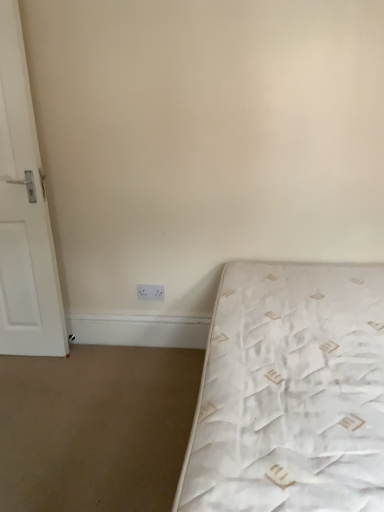
Question: Is white quilted mattress at lower right positioned with its back to white plastic electric outlet at lower center?

Choices:
 (A) yes
 (B) no

Answer: (B)

Question: Does white quilted mattress at lower right turn towards white plastic electric outlet at lower center?

Choices:
 (A) no
 (B) yes

Answer: (A)

Question: Does white quilted mattress at lower right have a lesser width compared to white plastic electric outlet at lower center?

Choices:
 (A) no
 (B) yes

Answer: (A)

Question: Is white plastic electric outlet at lower center located within white quilted mattress at lower right?

Choices:
 (A) no
 (B) yes

Answer: (A)

Question: Is white quilted mattress at lower right positioned beyond the bounds of white plastic electric outlet at lower center?

Choices:
 (A) no
 (B) yes

Answer: (B)

Question: Is point 162,286 closer or farther from the camera than point 43,288?

Choices:
 (A) farther
 (B) closer

Answer: (A)

Question: From the image's perspective, is white plastic electric outlet at lower center above or below white matte door at left?

Choices:
 (A) below
 (B) above

Answer: (A)

Question: Is white plastic electric outlet at lower center wider or thinner than white matte door at left?

Choices:
 (A) wide
 (B) thin

Answer: (B)

Question: Would you say white plastic electric outlet at lower center is inside or outside white matte door at left?

Choices:
 (A) inside
 (B) outside

Answer: (B)

Question: In the image, is white plastic electric outlet at lower center positioned in front of or behind white quilted mattress at lower right?

Choices:
 (A) behind
 (B) front

Answer: (A)

Question: Is white plastic electric outlet at lower center wider or thinner than white quilted mattress at lower right?

Choices:
 (A) wide
 (B) thin

Answer: (B)

Question: From their relative heights in the image, would you say white plastic electric outlet at lower center is taller or shorter than white quilted mattress at lower right?

Choices:
 (A) tall
 (B) short

Answer: (B)

Question: In the image, is white plastic electric outlet at lower center on the left side or the right side of white quilted mattress at lower right?

Choices:
 (A) left
 (B) right

Answer: (A)

Question: From the image's perspective, is white matte door at left positioned above or below white quilted mattress at lower right?

Choices:
 (A) below
 (B) above

Answer: (B)

Question: Relative to white quilted mattress at lower right, is white matte door at left in front or behind?

Choices:
 (A) behind
 (B) front

Answer: (A)